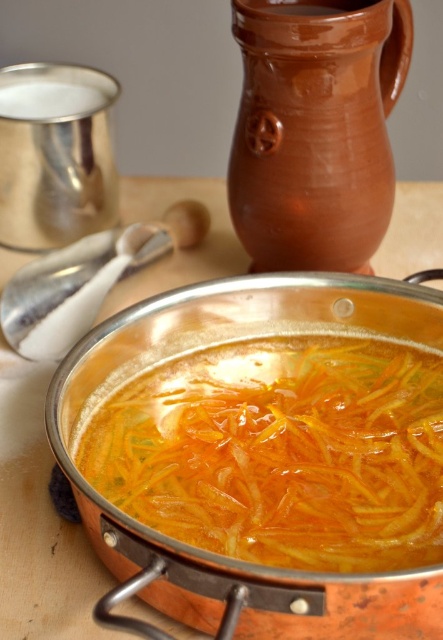
You are standing in a kitchen and want to reach the point at coordinates (81, 417). If your arm can extend 16 inches, can you comfortably reach that point without moving your feet?

The point at coordinates (81, 417) is 16.69 inches away from the viewer. Since your arm can only extend 16 inches, you cannot comfortably reach that point without moving your feet.

You are a chef preparing a dish and need to determine which object is shorter between the slightly translucent orange shredded carrots at center and the white plastic spoon at upper left. Based on the scene, which one is shorter?

The slightly translucent orange shredded carrots at center has a lesser height compared to the white plastic spoon at upper left, so the slightly translucent orange shredded carrots at center is shorter.

In the scene shown: You are preparing to serve soup from the shiny copper pot at center using the white plastic spoon at upper left. Can the spoon fit into the pot without touching the sides?

The shiny copper pot at center is wider than the white plastic spoon at upper left, so the spoon should fit inside without touching the sides.